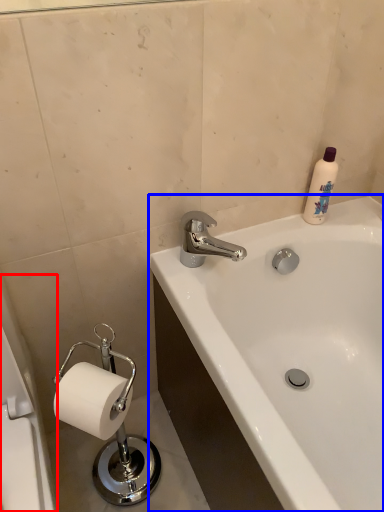
Question: Which object is closer to the camera taking this photo, bath (highlighted by a red box) or bathtub (highlighted by a blue box)?

Choices:
 (A) bath
 (B) bathtub

Answer: (A)